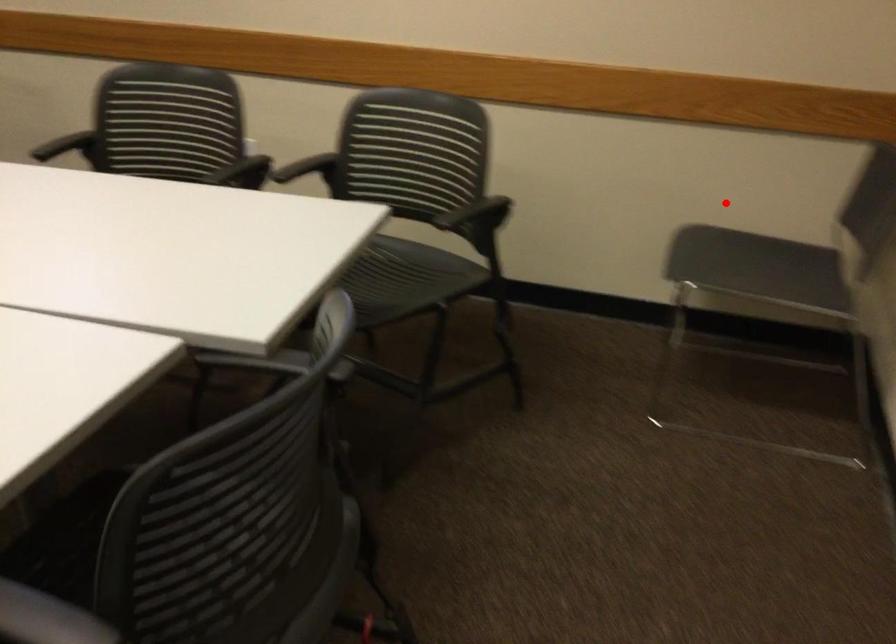
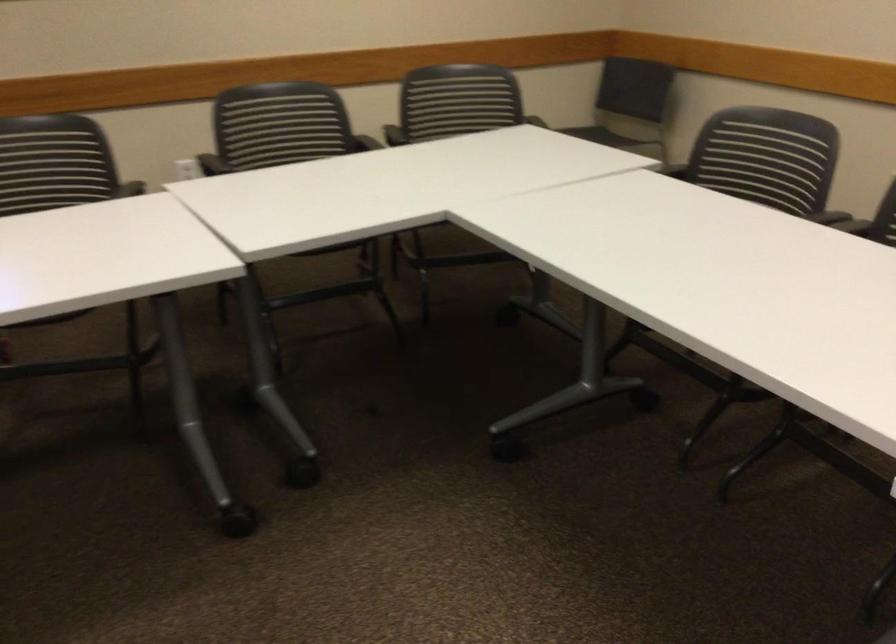
Question: I am providing you with two images of the same scene from different viewpoints. A red point is shown in image1. For the corresponding object point in image2, is it positioned nearer or farther from the camera?

Choices:
 (A) Nearer
 (B) Farther

Answer: (B)